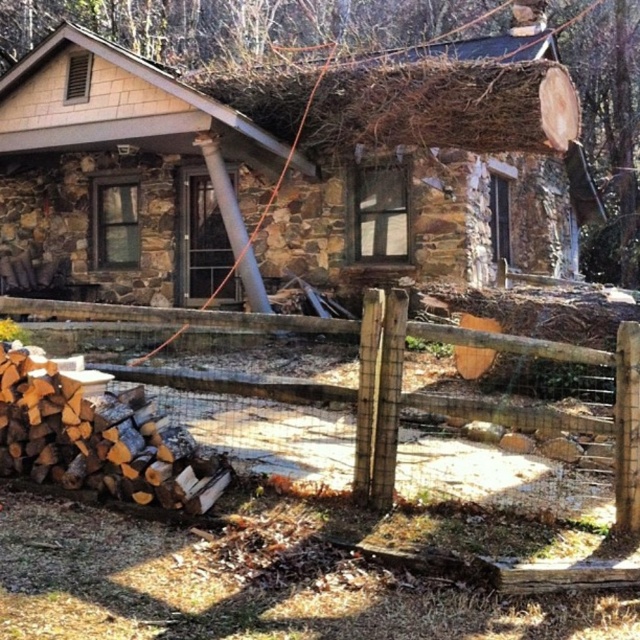
You are standing on the porch of the brown stone cabin at upper center and want to walk to the brown wooden fence at lower left. Which direction should you head to reach the fence?

To reach the brown wooden fence at lower left from the brown stone cabin at upper center, you should head downward since the cabin is positioned over the fence.

You are standing in front of the brown stone cabin at upper center and want to see if you can spot the brown wooden fence at lower left from your current position. Considering their heights, can you see the fence over the cabin?

The brown stone cabin at upper center is taller than the brown wooden fence at lower left, so the cabin may block your view of the fence depending on the distance between them. If you are close enough, you might see parts of the fence around the cabin, but if you are far away, the cabin could obscure it completely.